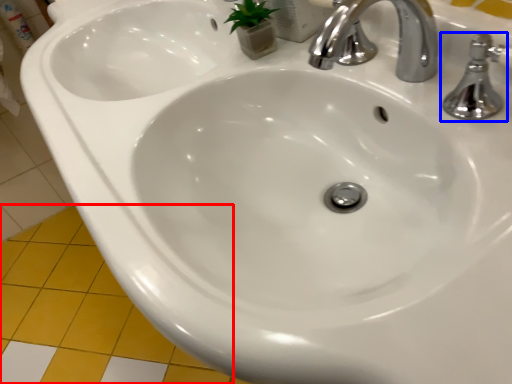
Question: Which object is closer to the camera taking this photo, ceramic tile (highlighted by a red box) or tap (highlighted by a blue box)?

Choices:
 (A) ceramic tile
 (B) tap

Answer: (B)